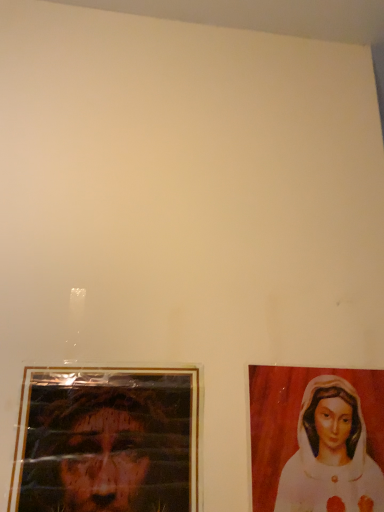
Question: Should I look upward or downward to see matte white painting of woman at right?

Choices:
 (A) up
 (B) down

Answer: (B)

Question: From the image's perspective, is gold-framed photo at lower left located above matte white painting of woman at right?

Choices:
 (A) no
 (B) yes

Answer: (B)

Question: Can you confirm if gold-framed photo at lower left is taller than matte white painting of woman at right?

Choices:
 (A) no
 (B) yes

Answer: (B)

Question: Is the position of gold-framed photo at lower left less distant than that of matte white painting of woman at right?

Choices:
 (A) no
 (B) yes

Answer: (B)

Question: From a real-world perspective, is gold-framed photo at lower left located higher than matte white painting of woman at right?

Choices:
 (A) yes
 (B) no

Answer: (B)

Question: Can you confirm if gold-framed photo at lower left is wider than matte white painting of woman at right?

Choices:
 (A) no
 (B) yes

Answer: (B)

Question: Considering the relative positions of gold-framed photo at lower left and matte white painting of woman at right in the image provided, is gold-framed photo at lower left to the right of matte white painting of woman at right from the viewer's perspective?

Choices:
 (A) yes
 (B) no

Answer: (B)

Question: Is matte white painting of woman at right not inside gold-framed photo at lower left?

Choices:
 (A) no
 (B) yes

Answer: (B)

Question: Is matte white painting of woman at right positioned in front of gold-framed photo at lower left?

Choices:
 (A) no
 (B) yes

Answer: (A)

Question: From the image's perspective, would you say matte white painting of woman at right is shown under gold-framed photo at lower left?

Choices:
 (A) no
 (B) yes

Answer: (B)

Question: From the image's perspective, does matte white painting of woman at right appear higher than gold-framed photo at lower left?

Choices:
 (A) no
 (B) yes

Answer: (A)

Question: Is matte white painting of woman at right to the left of gold-framed photo at lower left from the viewer's perspective?

Choices:
 (A) yes
 (B) no

Answer: (B)

Question: Does matte white painting of woman at right have a greater height compared to gold-framed photo at lower left?

Choices:
 (A) no
 (B) yes

Answer: (A)

Question: Is gold-framed photo at lower left spatially inside matte white painting of woman at right, or outside of it?

Choices:
 (A) outside
 (B) inside

Answer: (A)